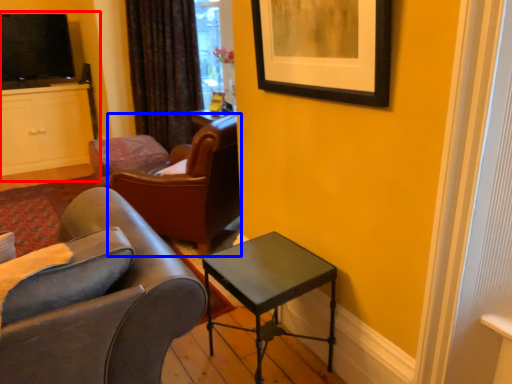
Question: Which object is closer to the camera taking this photo, entertainment center (highlighted by a red box) or chair (highlighted by a blue box)?

Choices:
 (A) entertainment center
 (B) chair

Answer: (B)